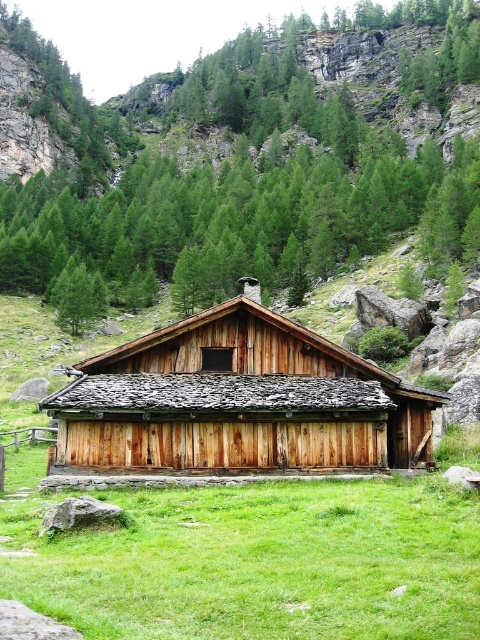
Can you confirm if green grass at center is shorter than green matte tree at center?

Yes, green grass at center is shorter than green matte tree at center.

Which is behind, point (272, 490) or point (90, 284)?

The point (90, 284) is more distant.

Find the location of a particular element. green grass at center is located at coordinates (261, 563).

Which is more to the right, green grass at center or wooden barn at center?

From the viewer's perspective, wooden barn at center appears more on the right side.

Is point (225, 598) positioned after point (207, 332)?

No, (225, 598) is in front of (207, 332).

Measure the distance between green grass at center and camera.

8.35 meters

At what (x,y) coordinates should I click in order to perform the action: click on green grass at center. Please return your answer as a coordinate pair (x, y). The height and width of the screenshot is (640, 480). Looking at the image, I should click on (261, 563).

Who is lower down, wooden barn at center or green matte tree at center?

Positioned lower is wooden barn at center.

What do you see at coordinates (238, 403) in the screenshot? This screenshot has width=480, height=640. I see `wooden barn at center` at bounding box center [238, 403].

You are a GUI agent. You are given a task and a screenshot of the screen. Output one action in this format:
    pyautogui.click(x=<x>, y=<y>)
    Task: Click on the wooden barn at center
    
    Given the screenshot: What is the action you would take?
    pyautogui.click(x=238, y=403)